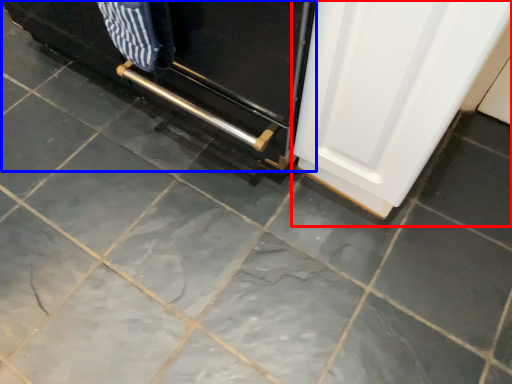
Question: Which object is closer to the camera taking this photo, door (highlighted by a red box) or oven (highlighted by a blue box)?

Choices:
 (A) door
 (B) oven

Answer: (A)